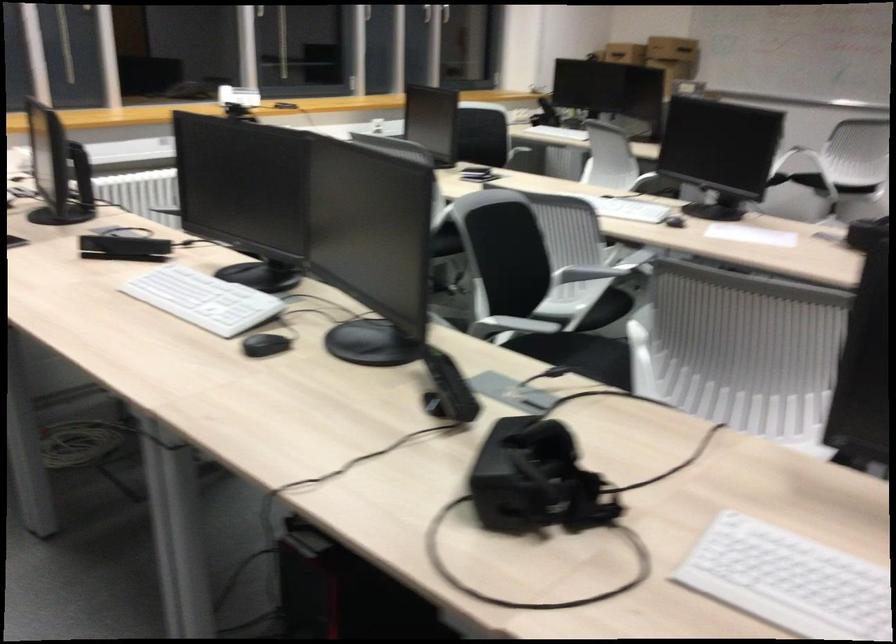
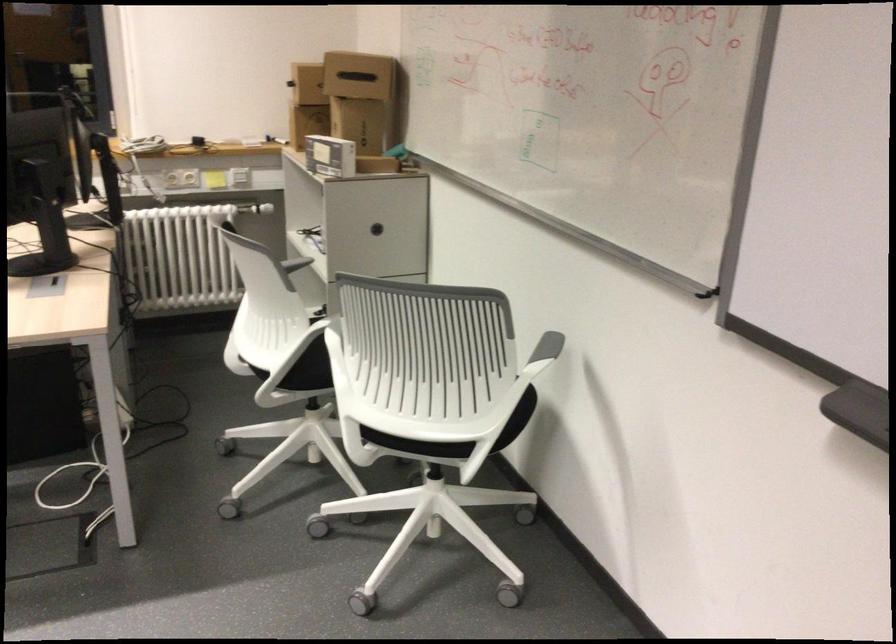
Question: I am providing you with two images of the same scene from different viewpoints. Please identify which objects are invisible in image2.

Choices:
 (A) round cabinet handle
 (B) projector arm
 (C) chair sitting surface
 (D) cardboard box

Answer: (D)